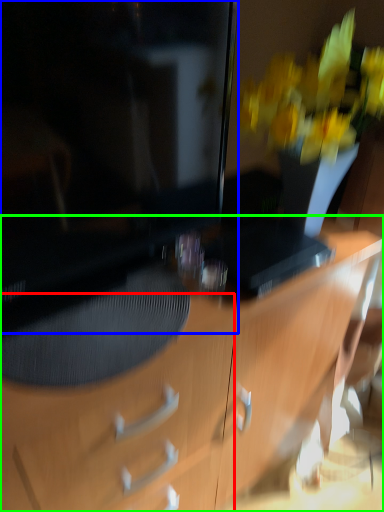
Question: Which is farther away from drawer (highlighted by a red box)? television (highlighted by a blue box) or desk (highlighted by a green box)?

Choices:
 (A) television
 (B) desk

Answer: (A)